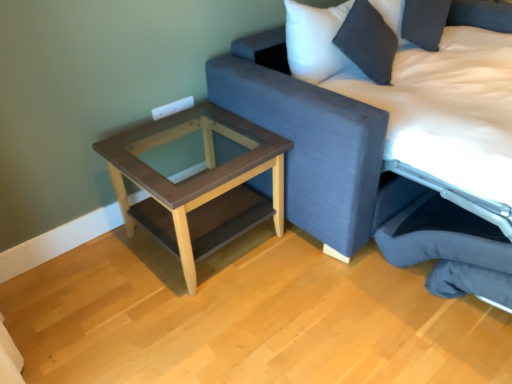
Question: Should I look upward or downward to see brown wood table at lower left?

Choices:
 (A) up
 (B) down

Answer: (A)

Question: From a real-world perspective, is brown wood table at lower left on top of textured fabric studio couch at upper right?

Choices:
 (A) yes
 (B) no

Answer: (B)

Question: Is brown wood table at lower left to the left of textured fabric studio couch at upper right from the viewer's perspective?

Choices:
 (A) no
 (B) yes

Answer: (B)

Question: Is brown wood table at lower left wider than textured fabric studio couch at upper right?

Choices:
 (A) no
 (B) yes

Answer: (A)

Question: Is brown wood table at lower left taller than textured fabric studio couch at upper right?

Choices:
 (A) yes
 (B) no

Answer: (B)

Question: From the image's perspective, would you say brown wood table at lower left is shown under textured fabric studio couch at upper right?

Choices:
 (A) yes
 (B) no

Answer: (A)

Question: Considering the relative sizes of brown wood table at lower left and textured fabric studio couch at upper right in the image provided, is brown wood table at lower left shorter than textured fabric studio couch at upper right?

Choices:
 (A) no
 (B) yes

Answer: (B)

Question: Considering the relative sizes of textured fabric studio couch at upper right and brown wood table at lower left in the image provided, is textured fabric studio couch at upper right smaller than brown wood table at lower left?

Choices:
 (A) no
 (B) yes

Answer: (A)

Question: Is textured fabric studio couch at upper right bigger than brown wood table at lower left?

Choices:
 (A) no
 (B) yes

Answer: (B)

Question: Is textured fabric studio couch at upper right with brown wood table at lower left?

Choices:
 (A) no
 (B) yes

Answer: (A)

Question: Is textured fabric studio couch at upper right positioned with its back to brown wood table at lower left?

Choices:
 (A) no
 (B) yes

Answer: (A)

Question: Is textured fabric studio couch at upper right further to camera compared to brown wood table at lower left?

Choices:
 (A) no
 (B) yes

Answer: (A)

Question: From the image's perspective, is textured fabric studio couch at upper right above brown wood table at lower left?

Choices:
 (A) no
 (B) yes

Answer: (B)

Question: Is textured fabric studio couch at upper right taller than dark gray fabric swivel chair at lower right?

Choices:
 (A) no
 (B) yes

Answer: (B)